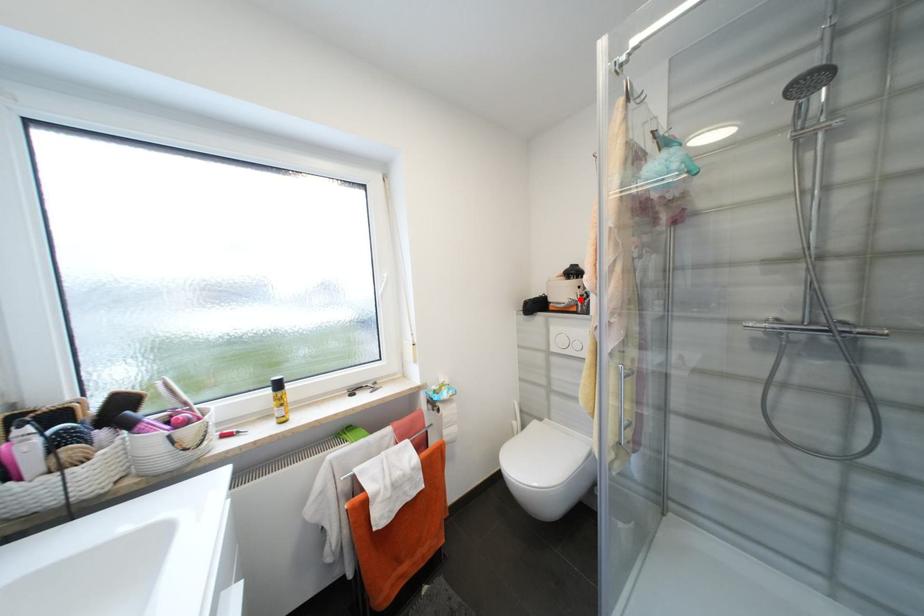
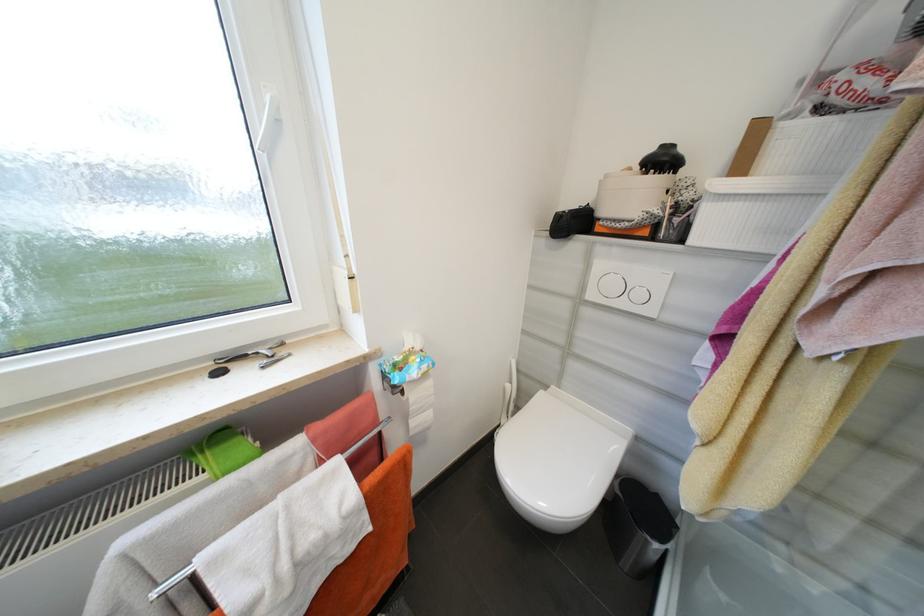
Where in the second image is the point corresponding to the highlighted location from the first image?

(663, 213)